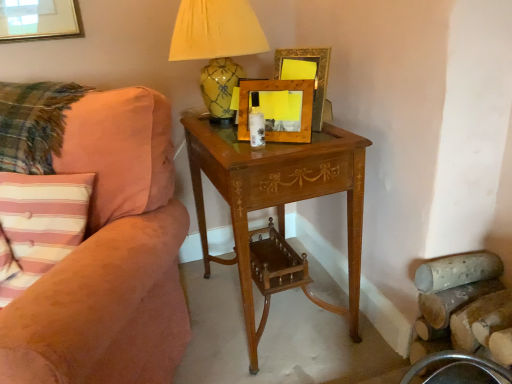
Identify the location of vacant space in front of wooden picture frame at center, which appears as the second picture frame when viewed from the back. The image size is (512, 384). (277, 149).